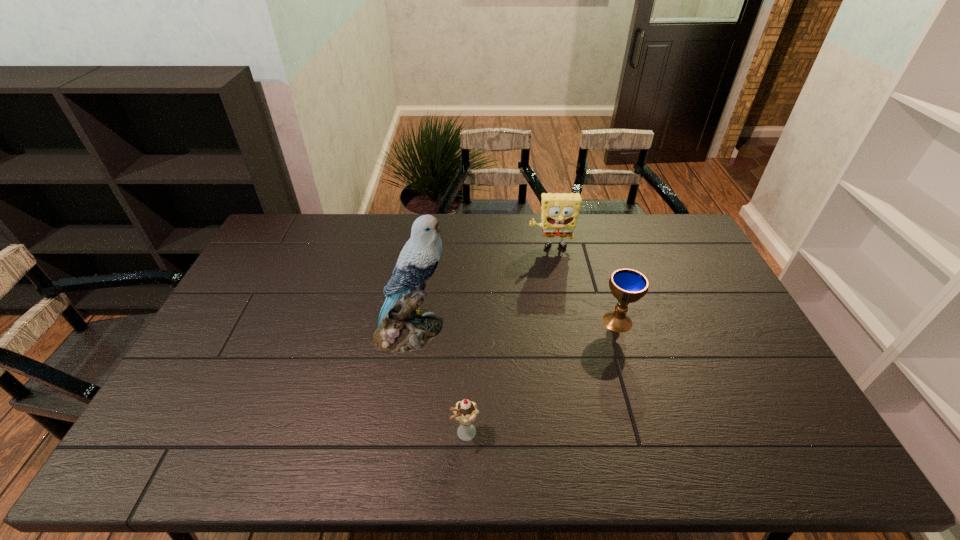
Locate an element on the screen. Image resolution: width=960 pixels, height=540 pixels. free space between the tallest object and the chalice is located at coordinates (515, 326).

Find the location of a particular element. This screenshot has height=540, width=960. free space between the leftmost object and the third object from right to left is located at coordinates (439, 382).

Where is `free space between the tallest object and the chalice`? This screenshot has height=540, width=960. free space between the tallest object and the chalice is located at coordinates (515, 326).

Locate an element on the screen. The height and width of the screenshot is (540, 960). free space that is in between the icecream and the sponge is located at coordinates (508, 341).

I want to click on free area in between the sponge and the chalice, so click(x=584, y=285).

Where is `unoccupied area between the third shortest object and the icecream`? unoccupied area between the third shortest object and the icecream is located at coordinates (508, 341).

I want to click on empty space between the third object from right to left and the chalice, so click(541, 377).

What are the coordinates of `vacant point located between the chalice and the tallest object` in the screenshot? It's located at (515, 326).

Find the location of a particular element. free space between the third object from left to right and the icecream is located at coordinates (508, 341).

Where is `free space between the third shortest object and the tallest object`? Image resolution: width=960 pixels, height=540 pixels. free space between the third shortest object and the tallest object is located at coordinates (481, 289).